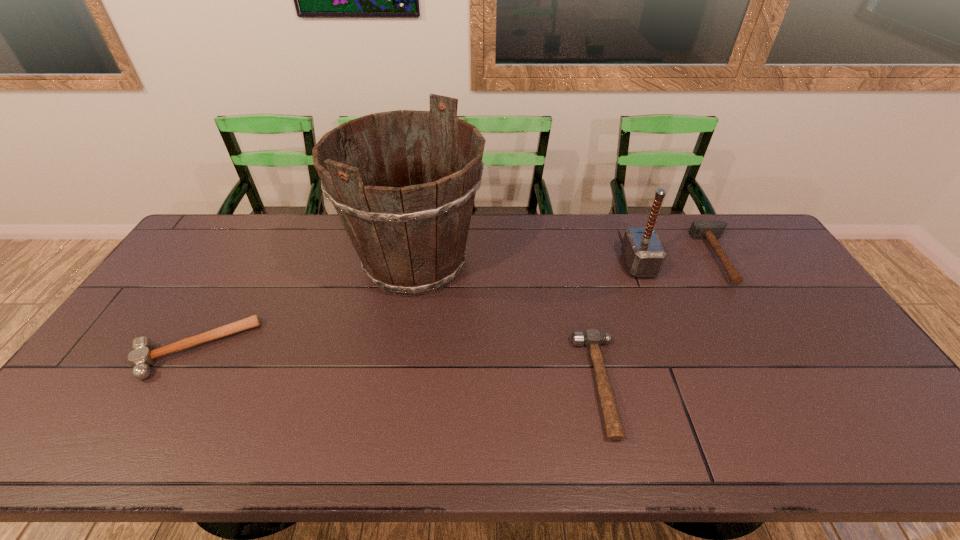
Identify the location of free point located on the striking surface of the rightmost hammer. The width and height of the screenshot is (960, 540). (669, 257).

Locate an element on the screen. vacant space located on the striking surface of the rightmost hammer is located at coordinates (684, 257).

This screenshot has width=960, height=540. I want to click on free space located 0.140m on the striking surface of the rightmost hammer, so click(660, 257).

In order to click on vacant space located 0.050m on the left of the leftmost hammer in this screenshot , I will do `click(120, 349)`.

Locate an element on the screen. free space located on the striking face of the second hammer from left to right is located at coordinates (481, 384).

Image resolution: width=960 pixels, height=540 pixels. In order to click on blank space located 0.360m on the striking face of the second hammer from left to right in this screenshot , I will do `click(437, 384)`.

What are the coordinates of `free point located on the striking face of the second hammer from left to right` in the screenshot? It's located at [444, 384].

At what (x,y) coordinates should I click in order to perform the action: click on bucket that is at the far edge. Please return your answer as a coordinate pair (x, y). Looking at the image, I should click on (411, 240).

Identify the location of object that is at the near edge. The image size is (960, 540). (592, 338).

Identify the location of object present at the left edge. (141, 357).